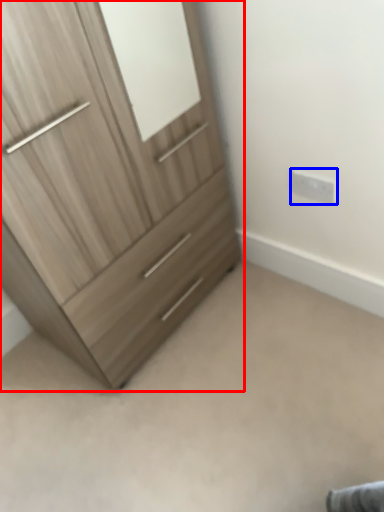
Question: Among these objects, which one is farthest to the camera, chest of drawers (highlighted by a red box) or electric outlet (highlighted by a blue box)?

Choices:
 (A) chest of drawers
 (B) electric outlet

Answer: (B)